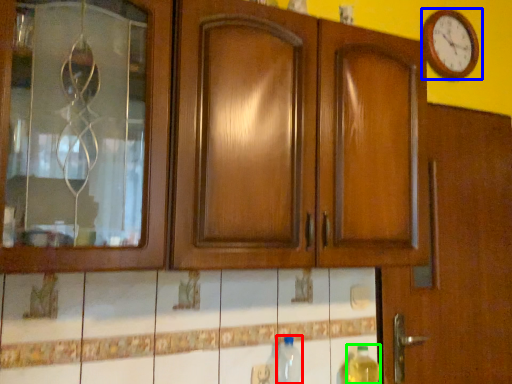
Question: Which is farther away from bottle (highlighted by a red box)? wall clock (highlighted by a blue box) or bottle (highlighted by a green box)?

Choices:
 (A) wall clock
 (B) bottle

Answer: (A)